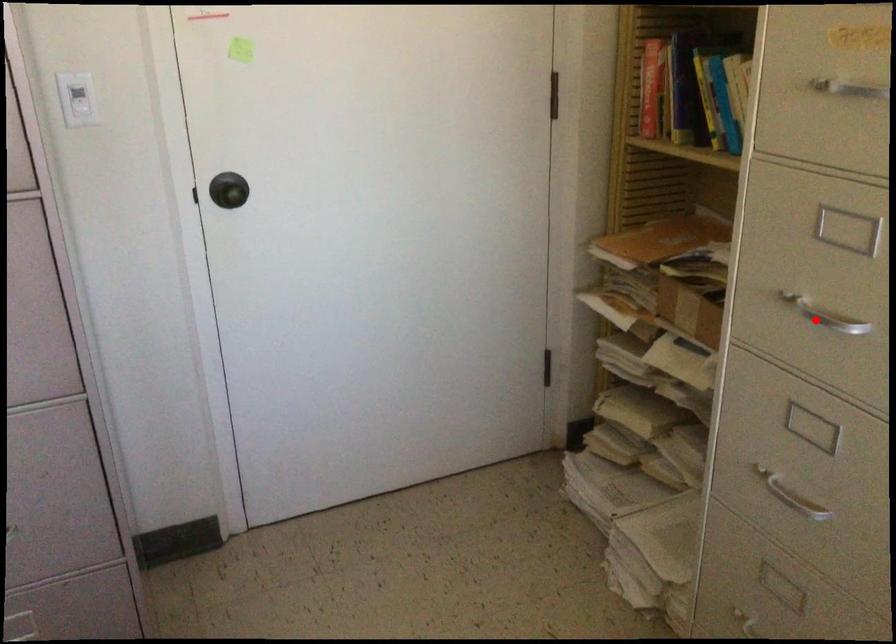
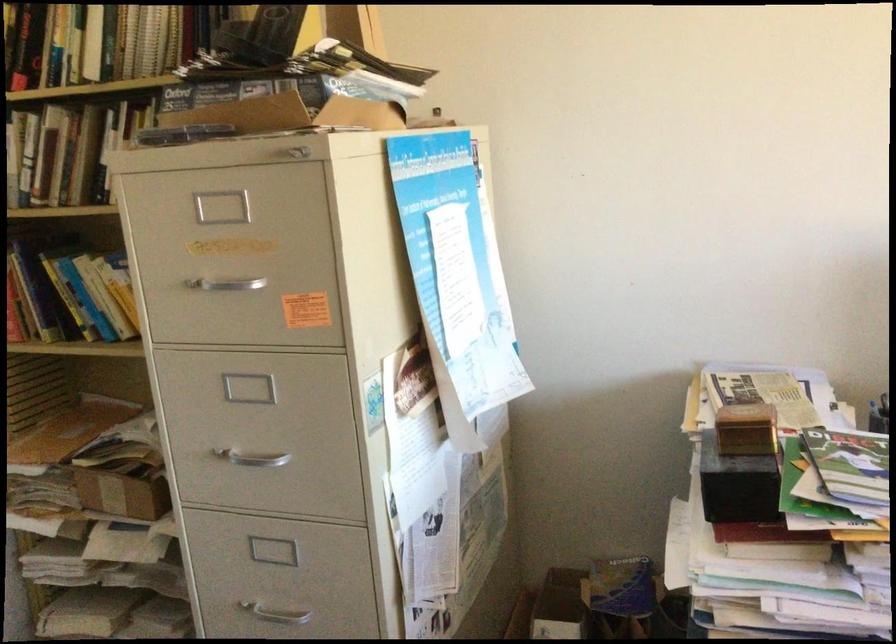
Question: A red point is marked in image1. In image2, is the corresponding 3D point closer to the camera or farther? Reply with the corresponding letter.

Choices:
 (A) The corresponding 3D point is closer.
 (B) The corresponding 3D point is farther.

Answer: (B)